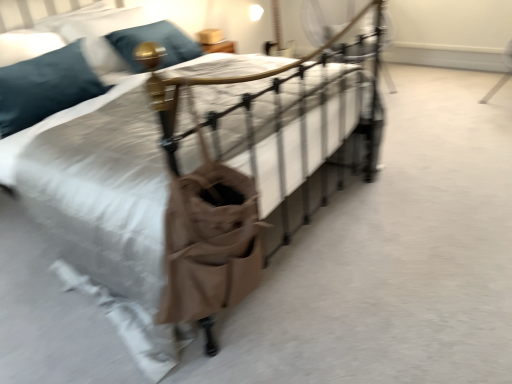
Question: In terms of height, does teal fabric pillow at upper left, the 2th pillow from the back, look taller or shorter compared to teal velvet pillow at upper left, the second pillow in the front-to-back sequence?

Choices:
 (A) short
 (B) tall

Answer: (B)

Question: Does point (50, 66) appear closer or farther from the camera than point (113, 64)?

Choices:
 (A) closer
 (B) farther

Answer: (A)

Question: Is teal fabric pillow at upper left, the first pillow positioned from the front, spatially inside teal velvet pillow at upper left, the second pillow in the front-to-back sequence, or outside of it?

Choices:
 (A) inside
 (B) outside

Answer: (B)

Question: Based on their positions, is teal velvet pillow at upper left, which ranks as the first pillow in back-to-front order, located to the left or right of teal fabric pillow at upper left, the first pillow positioned from the front?

Choices:
 (A) right
 (B) left

Answer: (A)

Question: Is teal velvet pillow at upper left, the second pillow in the front-to-back sequence, taller or shorter than teal fabric pillow at upper left, the first pillow positioned from the front?

Choices:
 (A) tall
 (B) short

Answer: (B)

Question: In terms of size, does teal velvet pillow at upper left, which ranks as the first pillow in back-to-front order, appear bigger or smaller than teal fabric pillow at upper left, the 2th pillow from the back?

Choices:
 (A) small
 (B) big

Answer: (A)

Question: From a real-world perspective, is teal velvet pillow at upper left, the second pillow in the front-to-back sequence, physically located above or below teal fabric pillow at upper left, the first pillow positioned from the front?

Choices:
 (A) above
 (B) below

Answer: (A)